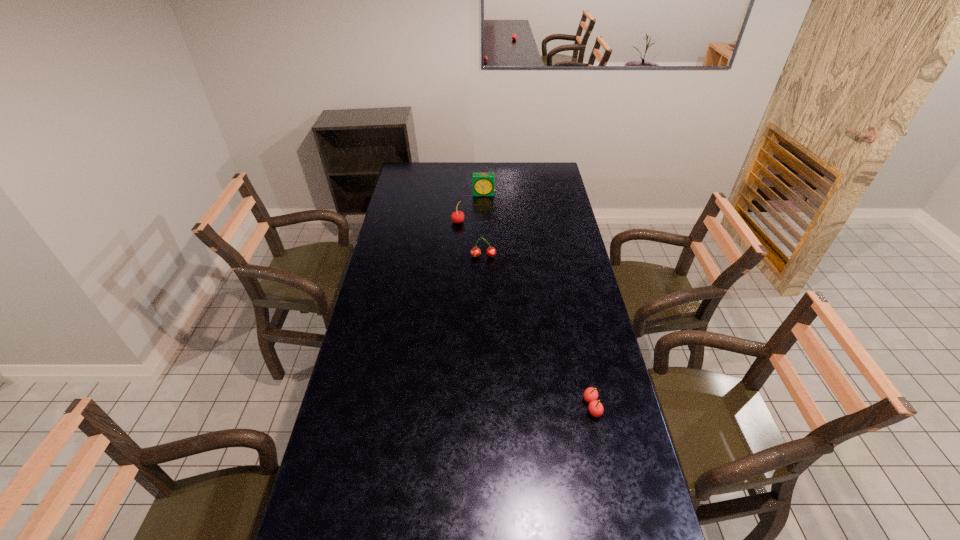
This screenshot has height=540, width=960. Find the location of `free space that satisfies the following two spatial constraints: 1. on the front-facing side of the alarm clock; 2. on the right side of the nearest object`. free space that satisfies the following two spatial constraints: 1. on the front-facing side of the alarm clock; 2. on the right side of the nearest object is located at coordinates (487, 406).

Where is `vacant space that satisfies the following two spatial constraints: 1. on the front-facing side of the rightmost cherry; 2. on the right side of the farthest object`? vacant space that satisfies the following two spatial constraints: 1. on the front-facing side of the rightmost cherry; 2. on the right side of the farthest object is located at coordinates (487, 406).

Identify the location of vacant region that satisfies the following two spatial constraints: 1. on the front side of the farthest cherry; 2. on the left side of the nearest object. The image size is (960, 540). (446, 406).

I want to click on vacant space that satisfies the following two spatial constraints: 1. with stems pointing upwards on the shortest cherry; 2. on the left side of the second farthest cherry, so click(x=485, y=406).

At what (x,y) coordinates should I click in order to perform the action: click on vacant space that satisfies the following two spatial constraints: 1. on the front-facing side of the nearest object; 2. on the left side of the farthest object. Please return your answer as a coordinate pair (x, y). The image size is (960, 540). Looking at the image, I should click on (487, 406).